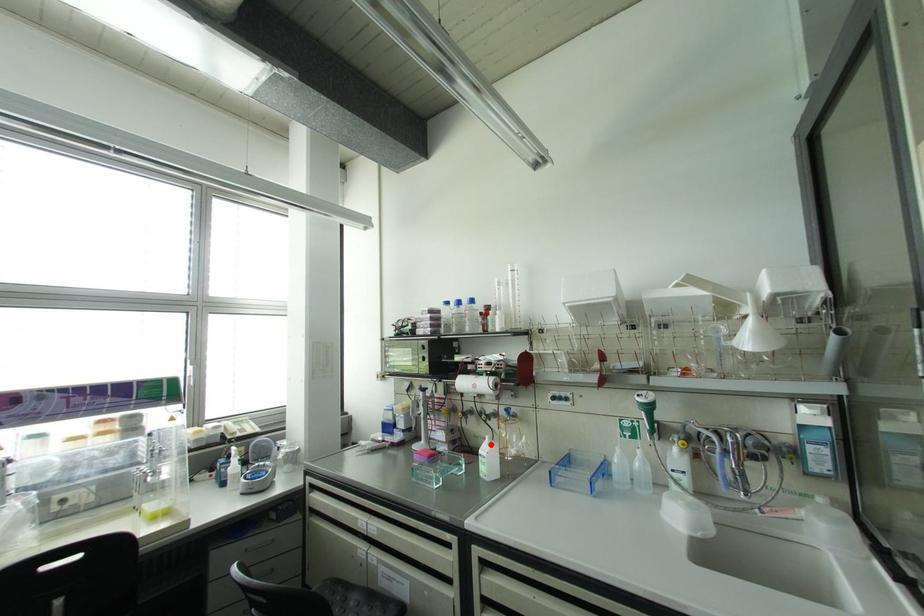
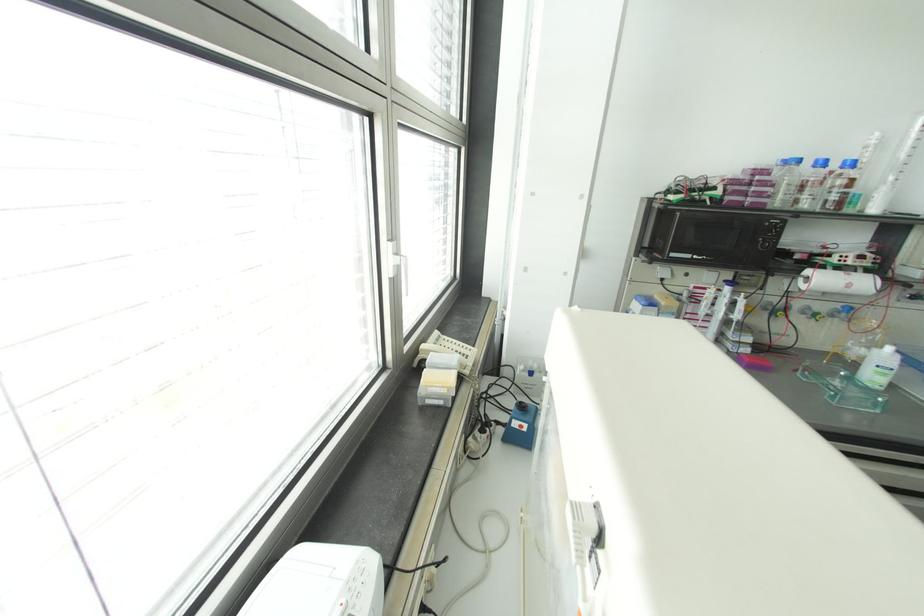
Question: I am providing you with two images of the same scene from different viewpoints. Given a red point in image1, look at the same physical point in image2. Is it:

Choices:
 (A) Closer to the viewpoint
 (B) Farther from the viewpoint

Answer: (A)